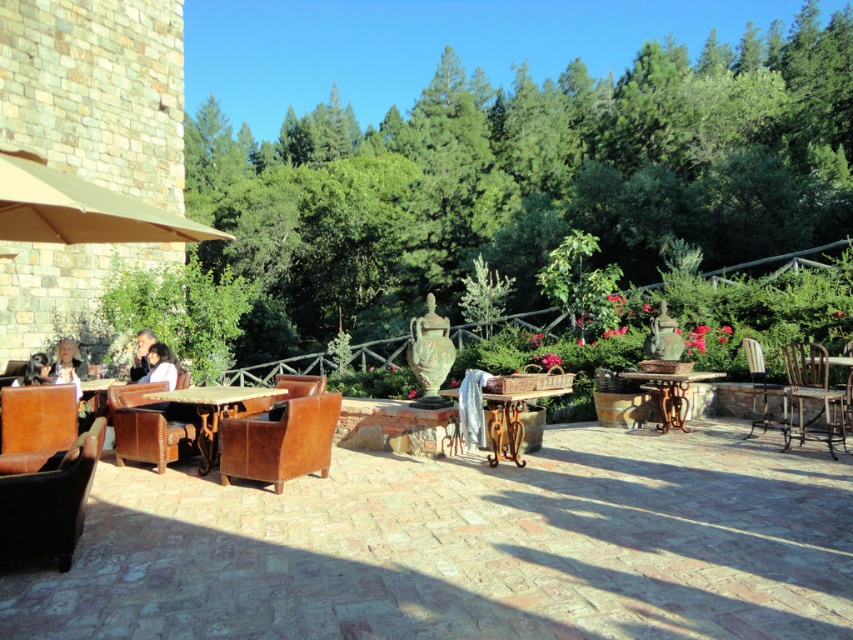
Does rustic wrought iron table at center have a greater width compared to blonde hair at left?

Yes.

Is rustic wrought iron table at center to the right of blonde hair at left from the viewer's perspective?

Yes, rustic wrought iron table at center is to the right of blonde hair at left.

Between point (517, 442) and point (62, 371), which one is positioned behind?

The point (62, 371) is behind.

Find the location of `rustic wrought iron table at center`. rustic wrought iron table at center is located at coordinates (509, 420).

From the picture: Which is above, leather chair at center or light brown leather chair at left?

Positioned higher is light brown leather chair at left.

Is leather chair at center shorter than light brown leather chair at left?

Yes.

Image resolution: width=853 pixels, height=640 pixels. Find the location of `leather chair at center`. leather chair at center is located at coordinates (294, 390).

Which is above, beige fabric umbrella at upper left or wooden chair at right?

beige fabric umbrella at upper left is above.

Between point (19, 193) and point (834, 403), which one is positioned behind?

Point (834, 403)

At what (x,y) coordinates should I click in order to perform the action: click on beige fabric umbrella at upper left. Please return your answer as a coordinate pair (x, y). The width and height of the screenshot is (853, 640). Looking at the image, I should click on (79, 209).